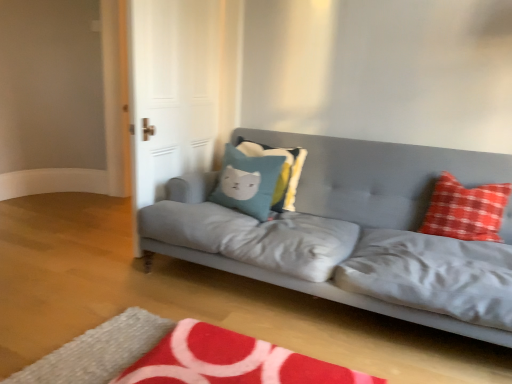
Identify the location of white glossy door at upper left. (173, 91).

This screenshot has width=512, height=384. What do you see at coordinates (466, 210) in the screenshot?
I see `red checkered pillow at right, which is the first pillow in right-to-left order` at bounding box center [466, 210].

I want to click on red plush rug at lower center, so click(x=230, y=361).

Can you tell me how much white glossy door at upper left and teal fabric pillow with cat design at center, the first pillow positioned from the left, differ in facing direction?

The angular difference between white glossy door at upper left and teal fabric pillow with cat design at center, the first pillow positioned from the left, is 86.9 degrees.

Is there a large distance between white glossy door at upper left and teal fabric pillow with cat design at center, which appears as the third pillow when viewed from the right?

They are positioned close to each other.

Considering the sizes of objects white glossy door at upper left and teal fabric pillow with cat design at center, the first pillow positioned from the left, in the image provided, who is shorter, white glossy door at upper left or teal fabric pillow with cat design at center, the first pillow positioned from the left,?

teal fabric pillow with cat design at center, the first pillow positioned from the left.

From the image's perspective, which is below, white glossy door at upper left or teal fabric pillow with cat design at center, which appears as the third pillow when viewed from the right?

teal fabric pillow with cat design at center, which appears as the third pillow when viewed from the right, from the image's perspective.

Can red plush rug at lower center be found inside teal fabric pillow at center, arranged as the second pillow when viewed from the right?

No, red plush rug at lower center is located outside of teal fabric pillow at center, arranged as the second pillow when viewed from the right.

Considering the relative sizes of teal fabric pillow at center, arranged as the second pillow when viewed from the right, and red plush rug at lower center in the image provided, is teal fabric pillow at center, arranged as the second pillow when viewed from the right, smaller than red plush rug at lower center?

Indeed, teal fabric pillow at center, arranged as the second pillow when viewed from the right, has a smaller size compared to red plush rug at lower center.

Between teal fabric pillow at center, arranged as the second pillow when viewed from the right, and red plush rug at lower center, which one appears on the right side from the viewer's perspective?

From the viewer's perspective, teal fabric pillow at center, arranged as the second pillow when viewed from the right, appears more on the right side.

Which is in front, teal fabric pillow at center, arranged as the second pillow when viewed from the right, or red plush rug at lower center?

red plush rug at lower center.

Consider the image. Can we say red plush rug at lower center lies outside teal fabric pillow with cat design at center, which appears as the third pillow when viewed from the right?

That's correct, red plush rug at lower center is outside of teal fabric pillow with cat design at center, which appears as the third pillow when viewed from the right.

The width and height of the screenshot is (512, 384). Identify the location of mat that appears in front of the teal fabric pillow with cat design at center, the first pillow positioned from the left. (230, 361).

Which object is positioned more to the left, red plush rug at lower center or teal fabric pillow with cat design at center, which appears as the third pillow when viewed from the right?

teal fabric pillow with cat design at center, which appears as the third pillow when viewed from the right, is more to the left.

Consider the image. Can you tell me how much red plush rug at lower center and teal fabric pillow with cat design at center, which appears as the third pillow when viewed from the right, differ in facing direction?

0.982 degrees.

How distant is teal fabric pillow with cat design at center, which appears as the third pillow when viewed from the right, from matte gray couch at center?

43.06 centimeters.

Between teal fabric pillow with cat design at center, which appears as the third pillow when viewed from the right, and matte gray couch at center, which one has smaller size?

teal fabric pillow with cat design at center, which appears as the third pillow when viewed from the right.

From the image's perspective, would you say teal fabric pillow with cat design at center, which appears as the third pillow when viewed from the right, is positioned over matte gray couch at center?

Yes.

Can you confirm if teal fabric pillow with cat design at center, the first pillow positioned from the left, is taller than matte gray couch at center?

In fact, teal fabric pillow with cat design at center, the first pillow positioned from the left, may be shorter than matte gray couch at center.

Is point (247, 210) farther from viewer compared to point (289, 185)?

That is False.

Can you confirm if teal fabric pillow with cat design at center, which appears as the third pillow when viewed from the right, is smaller than teal fabric pillow at center, arranged as the second pillow when viewed from the right?

No, teal fabric pillow with cat design at center, which appears as the third pillow when viewed from the right, is not smaller than teal fabric pillow at center, arranged as the second pillow when viewed from the right.

From the image's perspective, between teal fabric pillow with cat design at center, which appears as the third pillow when viewed from the right, and teal fabric pillow at center, arranged as the second pillow when viewed from the right, who is located below?

teal fabric pillow with cat design at center, which appears as the third pillow when viewed from the right, from the image's perspective.

Is teal fabric pillow with cat design at center, which appears as the third pillow when viewed from the right, in front of or behind teal fabric pillow at center, which is the 2th pillow from left to right, in the image?

teal fabric pillow with cat design at center, which appears as the third pillow when viewed from the right, is in front of teal fabric pillow at center, which is the 2th pillow from left to right.

Visually, is red plush rug at lower center positioned to the left or to the right of matte gray couch at center?

Based on their positions, red plush rug at lower center is located to the left of matte gray couch at center.

From a real-world perspective, which is physically above, red plush rug at lower center or matte gray couch at center?

matte gray couch at center.

Does red plush rug at lower center lie in front of matte gray couch at center?

Yes, red plush rug at lower center is closer to the viewer.

Considering the relative sizes of red plush rug at lower center and matte gray couch at center in the image provided, is red plush rug at lower center taller than matte gray couch at center?

No.

Does red checkered pillow at right, acting as the 3th pillow starting from the left, lie in front of teal fabric pillow at center, which is the 2th pillow from left to right?

Yes.

From the picture: From the image's perspective, is red checkered pillow at right, acting as the 3th pillow starting from the left, above or below teal fabric pillow at center, arranged as the second pillow when viewed from the right?

red checkered pillow at right, acting as the 3th pillow starting from the left, is below teal fabric pillow at center, arranged as the second pillow when viewed from the right.

Is red checkered pillow at right, which is the first pillow in right-to-left order, far away from teal fabric pillow at center, arranged as the second pillow when viewed from the right?

No, red checkered pillow at right, which is the first pillow in right-to-left order, is in close proximity to teal fabric pillow at center, arranged as the second pillow when viewed from the right.

Looking at this image, measure the distance from red checkered pillow at right, which is the first pillow in right-to-left order, to teal fabric pillow at center, which is the 2th pillow from left to right.

red checkered pillow at right, which is the first pillow in right-to-left order, and teal fabric pillow at center, which is the 2th pillow from left to right, are 35.03 inches apart.

Identify the location of glass door located above the teal fabric pillow with cat design at center, which appears as the third pillow when viewed from the right (from the image's perspective). (173, 91).

In order to click on mat located in front of the teal fabric pillow at center, arranged as the second pillow when viewed from the right in this screenshot , I will do `click(230, 361)`.

Considering their positions, is white glossy door at upper left positioned closer to matte gray couch at center than red checkered pillow at right, which is the first pillow in right-to-left order?

red checkered pillow at right, which is the first pillow in right-to-left order, is positioned closer to the anchor matte gray couch at center.

Considering their positions, is red plush rug at lower center positioned further to teal fabric pillow at center, which is the 2th pillow from left to right, than red checkered pillow at right, which is the first pillow in right-to-left order?

Based on the image, red plush rug at lower center appears to be further to teal fabric pillow at center, which is the 2th pillow from left to right.

Based on their spatial positions, is red plush rug at lower center or matte gray couch at center further from red checkered pillow at right, which is the first pillow in right-to-left order?

Among the two, red plush rug at lower center is located further to red checkered pillow at right, which is the first pillow in right-to-left order.

When comparing their distances from red checkered pillow at right, which is the first pillow in right-to-left order, does red plush rug at lower center or teal fabric pillow with cat design at center, the first pillow positioned from the left, seem further?

red plush rug at lower center lies further to red checkered pillow at right, which is the first pillow in right-to-left order, than the other object.

Estimate the real-world distances between objects in this image. Which object is closer to teal fabric pillow at center, arranged as the second pillow when viewed from the right, teal fabric pillow with cat design at center, which appears as the third pillow when viewed from the right, or red checkered pillow at right, acting as the 3th pillow starting from the left?

teal fabric pillow with cat design at center, which appears as the third pillow when viewed from the right.

Based on the photo, from the image, which object appears to be nearer to red checkered pillow at right, which is the first pillow in right-to-left order, white glossy door at upper left or teal fabric pillow at center, which is the 2th pillow from left to right?

teal fabric pillow at center, which is the 2th pillow from left to right, lies closer to red checkered pillow at right, which is the first pillow in right-to-left order, than the other object.

Looking at the image, which one is located closer to white glossy door at upper left, red plush rug at lower center or teal fabric pillow at center, arranged as the second pillow when viewed from the right?

Based on the image, teal fabric pillow at center, arranged as the second pillow when viewed from the right, appears to be nearer to white glossy door at upper left.

Based on their spatial positions, is teal fabric pillow at center, arranged as the second pillow when viewed from the right, or matte gray couch at center further from red checkered pillow at right, acting as the 3th pillow starting from the left?

teal fabric pillow at center, arranged as the second pillow when viewed from the right, is positioned further to the anchor red checkered pillow at right, acting as the 3th pillow starting from the left.

This screenshot has height=384, width=512. What are the coordinates of `glass door between red plush rug at lower center and teal fabric pillow with cat design at center, the first pillow positioned from the left, along the z-axis` in the screenshot? It's located at (173, 91).

Where is `studio couch between teal fabric pillow with cat design at center, which appears as the third pillow when viewed from the right, and red checkered pillow at right, acting as the 3th pillow starting from the left, in the horizontal direction`? studio couch between teal fabric pillow with cat design at center, which appears as the third pillow when viewed from the right, and red checkered pillow at right, acting as the 3th pillow starting from the left, in the horizontal direction is located at coordinates (379, 174).

The height and width of the screenshot is (384, 512). What are the coordinates of `glass door positioned between matte gray couch at center and teal fabric pillow at center, arranged as the second pillow when viewed from the right, from near to far` in the screenshot? It's located at (173, 91).

The height and width of the screenshot is (384, 512). Find the location of `pillow between teal fabric pillow with cat design at center, the first pillow positioned from the left, and red checkered pillow at right, acting as the 3th pillow starting from the left, in the horizontal direction`. pillow between teal fabric pillow with cat design at center, the first pillow positioned from the left, and red checkered pillow at right, acting as the 3th pillow starting from the left, in the horizontal direction is located at coordinates (280, 172).